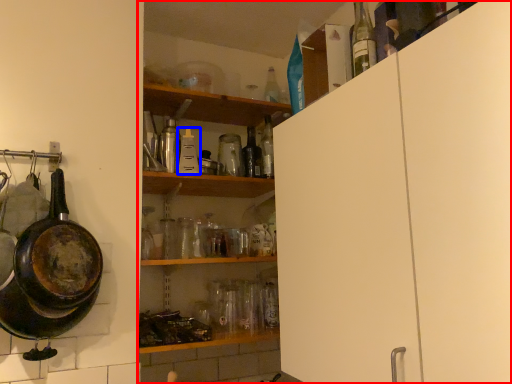
Question: Which point is further to the camera, shelf (highlighted by a red box) or bottle (highlighted by a blue box)?

Choices:
 (A) shelf
 (B) bottle

Answer: (B)